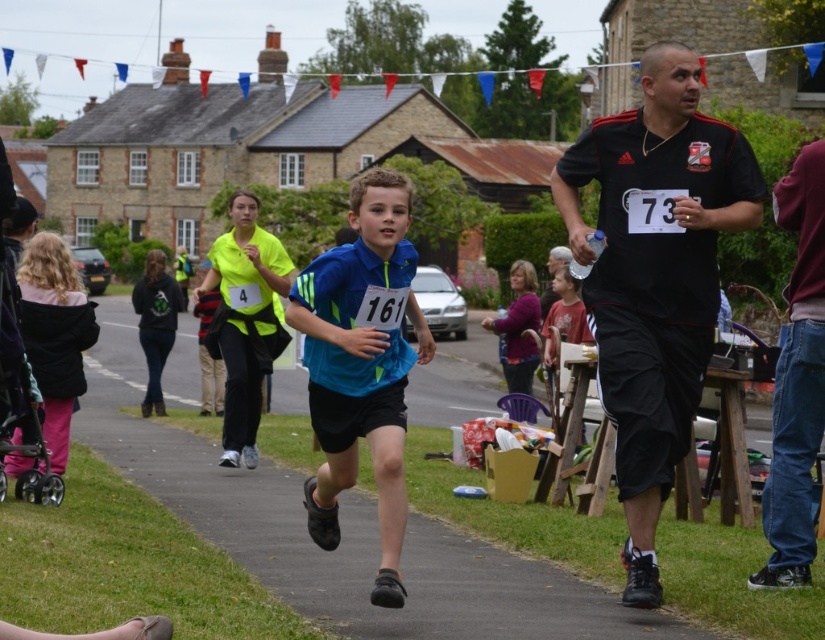
Which is more to the left, blue fabric shorts at center or black matte shirt at right?

From the viewer's perspective, blue fabric shorts at center appears more on the left side.

The image size is (825, 640). I want to click on blue fabric shorts at center, so click(342, 534).

I want to click on blue fabric shorts at center, so click(342, 534).

Can you confirm if black fleece jacket at left is smaller than purple fleece jacket at center?

Yes, black fleece jacket at left is smaller than purple fleece jacket at center.

Is point (69, 422) more distant than point (521, 304)?

No.

You are a GUI agent. You are given a task and a screenshot of the screen. Output one action in this format:
    pyautogui.click(x=<x>, y=<y>)
    Task: Click on the black fleece jacket at left
    
    Given the screenshot: What is the action you would take?
    pos(55,333)

Is blue fabric shorts at center wider than blue fabric shirt at center?

Indeed, blue fabric shorts at center has a greater width compared to blue fabric shirt at center.

Between blue fabric shorts at center and blue fabric shirt at center, which one is positioned higher?

blue fabric shirt at center is above.

Where is `blue fabric shorts at center`? The image size is (825, 640). blue fabric shorts at center is located at coordinates (342, 534).

This screenshot has width=825, height=640. In order to click on blue fabric shorts at center in this screenshot , I will do `click(342, 534)`.